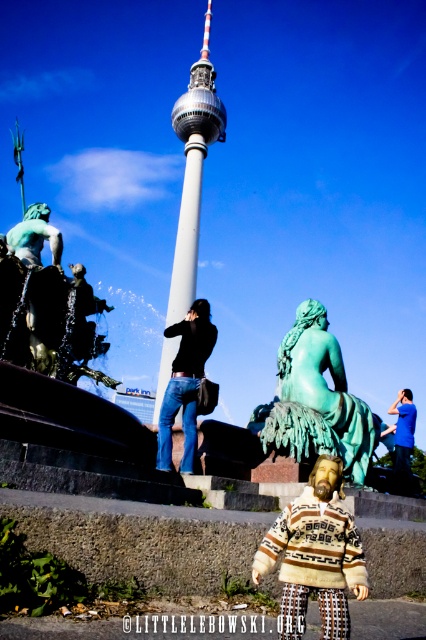
Does knitted sweater at center have a greater height compared to black matte jacket at center?

Incorrect, knitted sweater at center's height is not larger of black matte jacket at center's.

Is point (345, 609) less distant than point (175, 400)?

Yes, it is.

Which is behind, point (344, 614) or point (198, 364)?

Point (198, 364)

I want to click on knitted sweater at center, so [x=316, y=554].

Is green patina statue at left to the right of blue cotton shirt at center from the viewer's perspective?

Incorrect, green patina statue at left is not on the right side of blue cotton shirt at center.

Does green patina statue at left come in front of blue cotton shirt at center?

Yes, green patina statue at left is in front of blue cotton shirt at center.

Where is `green patina statue at left`? This screenshot has width=426, height=640. green patina statue at left is located at coordinates (46, 305).

Does point (83, 308) come farther from viewer compared to point (201, 52)?

That is False.

Describe the element at coordinates (46, 305) in the screenshot. Image resolution: width=426 pixels, height=640 pixels. I see `green patina statue at left` at that location.

At what (x,y) coordinates should I click in order to perform the action: click on green patina statue at left. Please return your answer as a coordinate pair (x, y). Looking at the image, I should click on (46, 305).